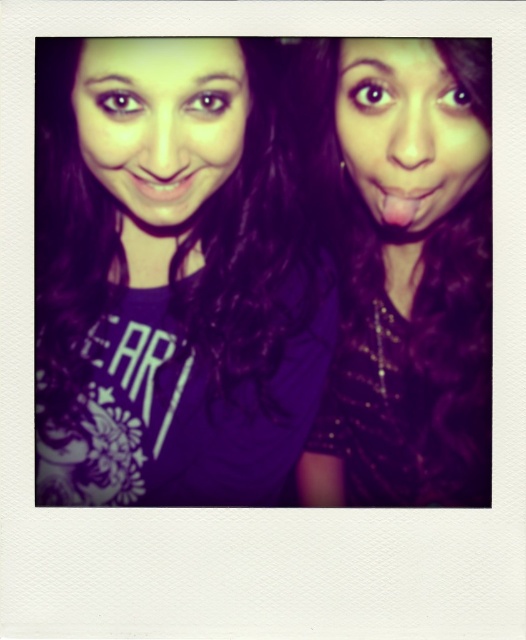
Based on the scene described, which object is wider, the pink glossy tongue at center or the matte pink lips at center?

The pink glossy tongue at center is wider than the matte pink lips at center according to the description.

You are a photographer trying to adjust the lighting for a closeup shot of the purple matte shirt at center and the pink glossy tongue at center in the Polaroid photo. Since the tongue is glossy and the shirt is matte, which object will reflect more light and require more careful lighting adjustments?

The pink glossy tongue at center will reflect more light than the purple matte shirt at center, so it requires more careful lighting adjustments because glossy surfaces reflect light more intensely compared to matte surfaces.